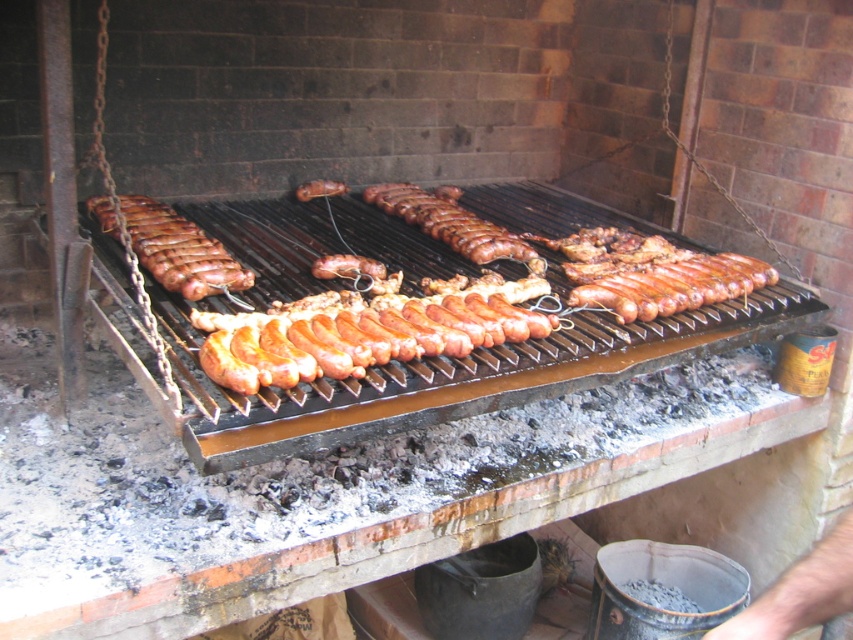
Question: Is brown glossy sausage at center bigger than brown matte sausage at center?

Choices:
 (A) no
 (B) yes

Answer: (B)

Question: Does shiny brown sausage at left have a smaller size compared to brown matte sausage at center?

Choices:
 (A) no
 (B) yes

Answer: (A)

Question: Can you confirm if shiny brown sausage at left is bigger than brown matte sausage at center?

Choices:
 (A) no
 (B) yes

Answer: (B)

Question: Among these points, which one is farthest from the camera?

Choices:
 (A) (514, 259)
 (B) (216, 282)

Answer: (A)

Question: Based on their relative distances, which object is farther from the shiny brown sausage at left?

Choices:
 (A) brown matte sausage at center
 (B) brown glossy sausage at center

Answer: (B)

Question: Which of the following is the closest to the observer?

Choices:
 (A) shiny brown sausage at left
 (B) brown glossy sausage at center

Answer: (A)